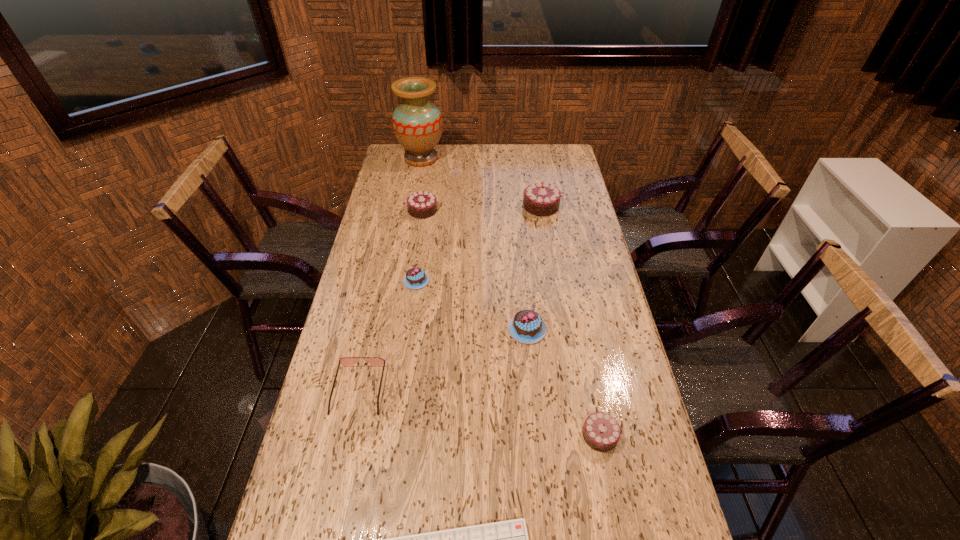
Identify the location of object located in the far edge section of the desktop. tap(417, 123).

This screenshot has height=540, width=960. In order to click on vase that is at the left edge in this screenshot , I will do `click(417, 123)`.

What are the coordinates of `chocolate cake that is at the left edge` in the screenshot? It's located at (422, 204).

Identify the location of sunglasses positioned at the left edge. Image resolution: width=960 pixels, height=540 pixels. (345, 361).

Where is `object situated at the far left corner`? object situated at the far left corner is located at coordinates (417, 123).

The image size is (960, 540). Find the location of `vacant space at the far edge of the desktop`. vacant space at the far edge of the desktop is located at coordinates (535, 166).

Locate an element on the screen. Image resolution: width=960 pixels, height=540 pixels. free space at the left edge is located at coordinates (353, 278).

The height and width of the screenshot is (540, 960). Find the location of `vacant area at the right edge of the desktop`. vacant area at the right edge of the desktop is located at coordinates (613, 298).

Find the location of a particular element. This screenshot has width=960, height=540. vacant area between the third farthest chocolate cake and the right pink chocolate cake is located at coordinates tap(471, 305).

Find the location of `vacant space that is in between the nearest chocolate cake and the farther pink chocolate cake`. vacant space that is in between the nearest chocolate cake and the farther pink chocolate cake is located at coordinates (508, 358).